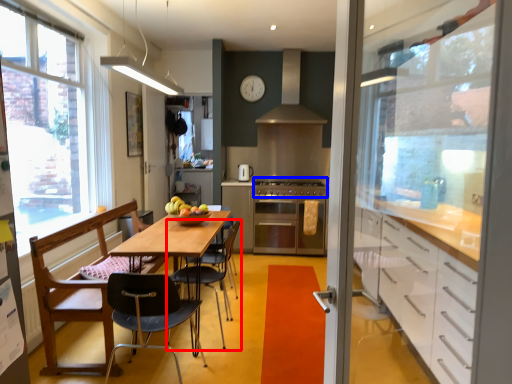
Question: Among these objects, which one is nearest to the camera, chair (highlighted by a red box) or gas stove (highlighted by a blue box)?

Choices:
 (A) chair
 (B) gas stove

Answer: (A)